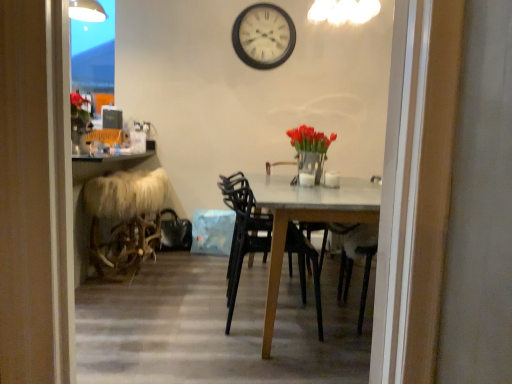
The height and width of the screenshot is (384, 512). Describe the element at coordinates (124, 219) in the screenshot. I see `furry white folding chair at left` at that location.

Where is `furry white folding chair at left`? furry white folding chair at left is located at coordinates (124, 219).

This screenshot has width=512, height=384. What do you see at coordinates (263, 36) in the screenshot?
I see `white matte wall clock at upper center` at bounding box center [263, 36].

Identify the location of furry white folding chair at left. (124, 219).

From the image's perspective, which one is positioned lower, matte silver vase with red tulips at center or furry white folding chair at left?

furry white folding chair at left, from the image's perspective.

Based on their sizes in the image, would you say matte silver vase with red tulips at center is bigger or smaller than furry white folding chair at left?

Clearly, matte silver vase with red tulips at center is smaller in size than furry white folding chair at left.

Can you confirm if matte silver vase with red tulips at center is positioned to the left of furry white folding chair at left?

No.

Considering the sizes of objects matte silver vase with red tulips at center and furry white folding chair at left in the image provided, who is thinner, matte silver vase with red tulips at center or furry white folding chair at left?

With smaller width is matte silver vase with red tulips at center.

Does black plastic chair at center have a lesser height compared to furry white folding chair at left?

Incorrect, the height of black plastic chair at center does not fall short of that of furry white folding chair at left.

Measure the distance from black plastic chair at center to furry white folding chair at left.

black plastic chair at center is 32.83 inches from furry white folding chair at left.

Are black plastic chair at center and furry white folding chair at left far apart?

That's not correct — black plastic chair at center is a little close to furry white folding chair at left.

Which object is wider, black plastic chair at center or furry white folding chair at left?

With larger width is black plastic chair at center.

Which is in front, point (319, 180) or point (242, 54)?

Positioned in front is point (319, 180).

Is matte silver vase with red tulips at center to the left of white matte wall clock at upper center from the viewer's perspective?

Incorrect, matte silver vase with red tulips at center is not on the left side of white matte wall clock at upper center.

Between matte silver vase with red tulips at center and white matte wall clock at upper center, which one has larger width?

With larger width is matte silver vase with red tulips at center.

Is matte silver vase with red tulips at center oriented away from white matte wall clock at upper center?

No.

Considering the sizes of black plastic chair at center and matte silver vase with red tulips at center in the image, is black plastic chair at center taller or shorter than matte silver vase with red tulips at center?

black plastic chair at center is taller than matte silver vase with red tulips at center.

How far apart are black plastic chair at center and matte silver vase with red tulips at center?

They are 22.93 inches apart.

Based on the photo, from the image's perspective, is black plastic chair at center over matte silver vase with red tulips at center?

No.

Does point (240, 193) appear closer or farther from the camera than point (302, 145)?

Clearly, point (240, 193) is closer to the camera than point (302, 145).

How different are the orientations of furry white folding chair at left and matte silver vase with red tulips at center in degrees?

0.000198 degrees separate the facing orientations of furry white folding chair at left and matte silver vase with red tulips at center.

Is furry white folding chair at left placed right next to matte silver vase with red tulips at center?

No, furry white folding chair at left is not in contact with matte silver vase with red tulips at center.

Can you confirm if furry white folding chair at left is taller than matte silver vase with red tulips at center?

Yes.

In terms of width, does matte silver vase with red tulips at center look wider or thinner when compared to black plastic chair at center?

Considering their sizes, matte silver vase with red tulips at center looks slimmer than black plastic chair at center.

The height and width of the screenshot is (384, 512). Find the location of `chair on the left of the matte silver vase with red tulips at center`. chair on the left of the matte silver vase with red tulips at center is located at coordinates (242, 232).

Is point (292, 143) closer or farther from the camera than point (302, 233)?

Point (292, 143) is farther from the camera than point (302, 233).

In the scene shown: Between transparent glass door at upper left and black plastic chair at center, which one has more height?

Standing taller between the two is transparent glass door at upper left.

Is the depth of transparent glass door at upper left less than that of black plastic chair at center?

No, transparent glass door at upper left is further to the viewer.

In the scene shown: How many degrees apart are the facing directions of transparent glass door at upper left and black plastic chair at center?

The angle between the facing direction of transparent glass door at upper left and the facing direction of black plastic chair at center is 90 degrees.

Does transparent glass door at upper left have a smaller size compared to black plastic chair at center?

Yes.

This screenshot has height=384, width=512. I want to click on folding chair lying behind the matte silver vase with red tulips at center, so click(x=124, y=219).

You are a GUI agent. You are given a task and a screenshot of the screen. Output one action in this format:
    pyautogui.click(x=<x>, y=<y>)
    Task: Click on the folding chair directly beneath the black plastic chair at center (from a real-world perspective)
    
    Given the screenshot: What is the action you would take?
    pyautogui.click(x=124, y=219)

Based on their spatial positions, is matte silver vase with red tulips at center or white matte wall clock at upper center further from transparent glass door at upper left?

matte silver vase with red tulips at center.

Based on the photo, from the image, which object appears to be nearer to transparent glass door at upper left, furry white folding chair at left or black plastic chair at center?

The object closer to transparent glass door at upper left is furry white folding chair at left.

Which object lies nearer to the anchor point furry white folding chair at left, black plastic chair at center or matte silver vase with red tulips at center?

The object closer to furry white folding chair at left is black plastic chair at center.

Considering their positions, is black plastic chair at center positioned further to transparent glass door at upper left than white matte wall clock at upper center?

Based on the image, black plastic chair at center appears to be further to transparent glass door at upper left.

Looking at the image, which one is located closer to black plastic chair at center, matte silver vase with red tulips at center or transparent glass door at upper left?

matte silver vase with red tulips at center.

Consider the image. Considering their positions, is matte silver vase with red tulips at center positioned further to furry white folding chair at left than white matte wall clock at upper center?

The object further to furry white folding chair at left is white matte wall clock at upper center.

Which object lies nearer to the anchor point transparent glass door at upper left, furry white folding chair at left or white matte wall clock at upper center?

The object closer to transparent glass door at upper left is white matte wall clock at upper center.

Based on their spatial positions, is furry white folding chair at left or transparent glass door at upper left closer to black plastic chair at center?

furry white folding chair at left is positioned closer to the anchor black plastic chair at center.

Image resolution: width=512 pixels, height=384 pixels. Find the location of `folding chair between black plastic chair at center and transparent glass door at upper left along the z-axis`. folding chair between black plastic chair at center and transparent glass door at upper left along the z-axis is located at coordinates (124, 219).

This screenshot has height=384, width=512. I want to click on chair located between furry white folding chair at left and matte silver vase with red tulips at center in the left-right direction, so click(242, 232).

Locate an element on the screen. The height and width of the screenshot is (384, 512). floral arrangement that lies between white matte wall clock at upper center and furry white folding chair at left from top to bottom is located at coordinates (310, 149).

Locate an element on the screen. chair located between transparent glass door at upper left and matte silver vase with red tulips at center in the left-right direction is located at coordinates (242, 232).